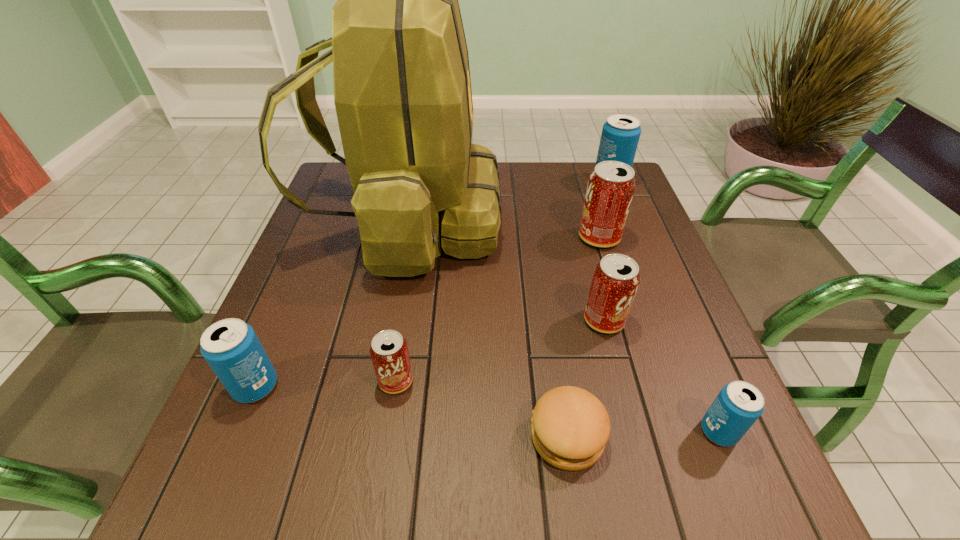
Find the location of a particular element. This screenshot has height=540, width=960. vacant space at the far edge of the desktop is located at coordinates (570, 187).

In the image, there is a desktop. Identify the location of vacant area at the near edge. (649, 498).

The height and width of the screenshot is (540, 960). In the image, there is a desktop. Identify the location of free space at the left edge. (290, 295).

The width and height of the screenshot is (960, 540). In the image, there is a desktop. In order to click on free space at the right edge in this screenshot , I will do `click(636, 342)`.

In the image, there is a desktop. Identify the location of vacant space at the near left corner. The height and width of the screenshot is (540, 960). (271, 479).

This screenshot has height=540, width=960. Identify the location of vacant area at the near right corner. (676, 521).

Where is `free space between the tallest object and the second smallest red soda can`? This screenshot has height=540, width=960. free space between the tallest object and the second smallest red soda can is located at coordinates (505, 271).

I want to click on free space between the fifth nearest soda can and the smallest blue soda can, so click(659, 334).

Find the location of a particular element. Image resolution: width=960 pixels, height=540 pixels. vacant space in between the backpack and the biggest red soda can is located at coordinates tap(502, 230).

Where is `free space between the second nearest blue soda can and the smallest blue soda can`? free space between the second nearest blue soda can and the smallest blue soda can is located at coordinates (488, 409).